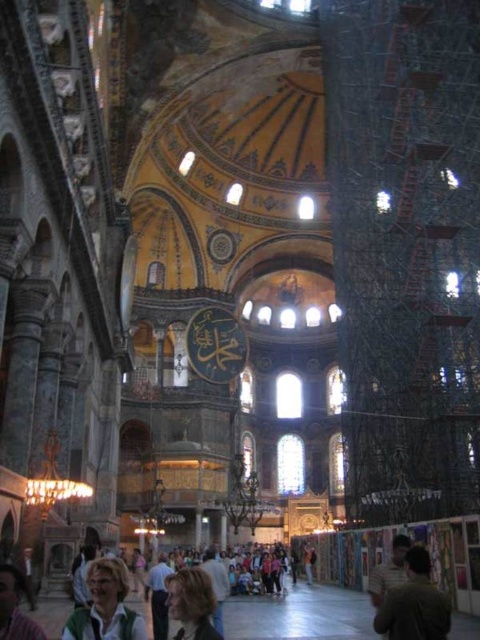
Question: Does green fabric jacket at lower left have a smaller size compared to light brown hair at lower left?

Choices:
 (A) no
 (B) yes

Answer: (A)

Question: Which object is positioned closest to the green fabric jacket at lower left?

Choices:
 (A) dark green fabric at lower right
 (B) blonde hair at center
 (C) light brown hair at lower left

Answer: (B)

Question: Can you confirm if dark green fabric at lower right is smaller than green fabric jacket at lower left?

Choices:
 (A) no
 (B) yes

Answer: (B)

Question: Among these points, which one is nearest to the camera?

Choices:
 (A) (110, 589)
 (B) (176, 618)

Answer: (B)

Question: Among these objects, which one is farthest from the camera?

Choices:
 (A) green fabric jacket at lower left
 (B) light brown hair at lower left
 (C) dark green fabric at lower right

Answer: (C)

Question: Can you confirm if blonde hair at center is positioned below light brown hair at lower left?

Choices:
 (A) no
 (B) yes

Answer: (B)